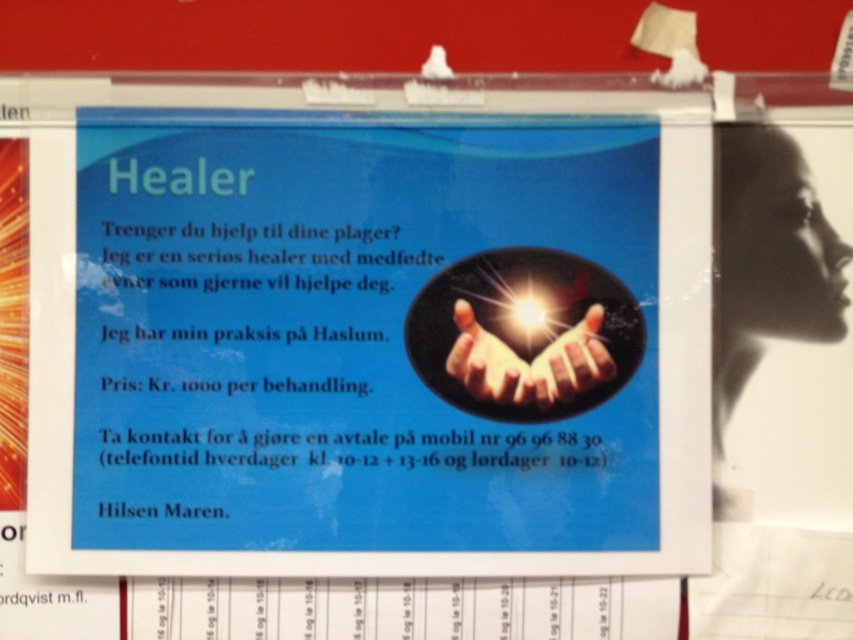
Question: Can you confirm if shiny golden hands at center is positioned to the right of translucent glowing hands at center?

Choices:
 (A) no
 (B) yes

Answer: (B)

Question: Estimate the real-world distances between objects in this image. Which object is closer to the translucent glowing hands at center?

Choices:
 (A) shiny metallic hand at center
 (B) shiny golden hands at center

Answer: (B)

Question: Based on their relative distances, which object is nearer to the shiny metallic hand at center?

Choices:
 (A) translucent glowing hands at center
 (B) shiny golden hands at center

Answer: (B)

Question: Is shiny golden hands at center smaller than translucent glowing hands at center?

Choices:
 (A) yes
 (B) no

Answer: (B)

Question: Is shiny golden hands at center positioned before translucent glowing hands at center?

Choices:
 (A) yes
 (B) no

Answer: (A)

Question: Which point appears farthest from the camera in this image?

Choices:
 (A) (579, 321)
 (B) (477, 360)

Answer: (A)